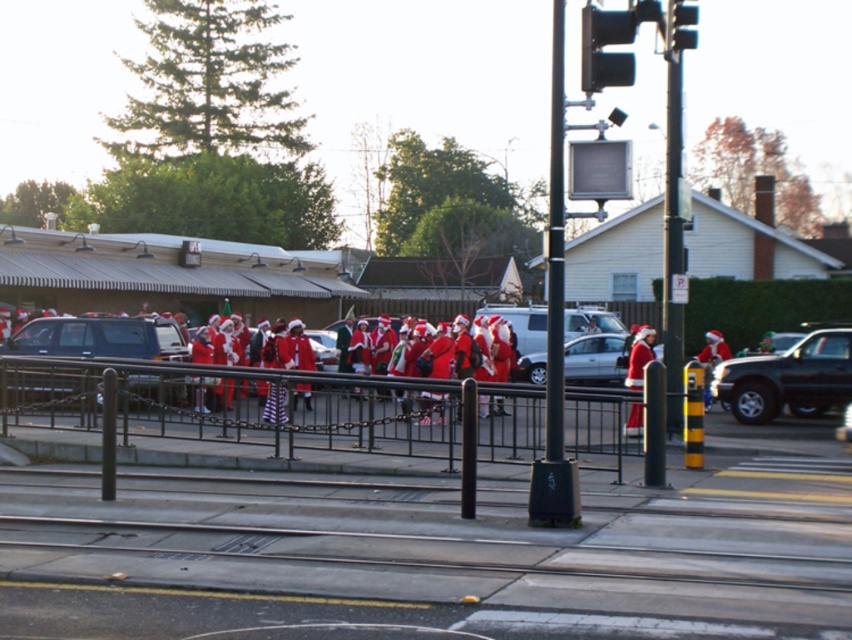
You are standing at the position of point (x=645, y=332) and want to move towards the position of point (x=545, y=378). According to the scene, will you be moving forward or backward relative to your current position?

Since point (x=545, y=378) is behind point (x=645, y=332), moving towards it would mean moving backward relative to your current position.

You are a photographer trying to capture the matte red santa suit at center and the black plastic traffic light at upper center in the same frame. Which object will appear larger in your photo?

The black plastic traffic light at upper center will appear larger in the photo because it is closer to the viewer than the matte red santa suit at center.